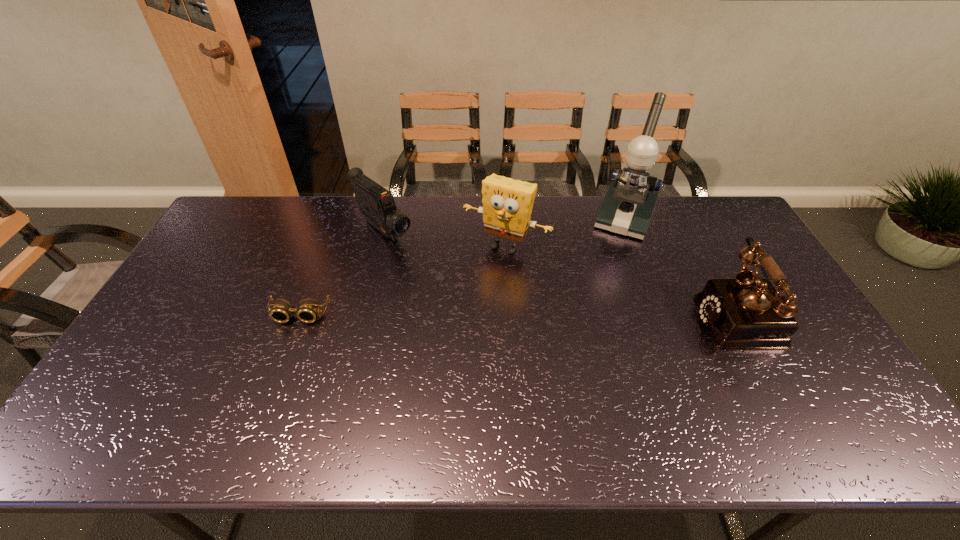
Find the location of a particular element. The height and width of the screenshot is (540, 960). camcorder that is at the far edge is located at coordinates (376, 203).

Where is `object that is positioned at the right edge`? The height and width of the screenshot is (540, 960). object that is positioned at the right edge is located at coordinates (747, 312).

You are a GUI agent. You are given a task and a screenshot of the screen. Output one action in this format:
    pyautogui.click(x=<x>, y=<y>)
    Task: Click on the free spot at the far edge of the desktop
    
    Given the screenshot: What is the action you would take?
    pyautogui.click(x=468, y=218)

Locate an element on the screen. The width and height of the screenshot is (960, 540). vacant space at the near edge is located at coordinates (627, 399).

Where is `free space at the left edge of the desktop`? This screenshot has width=960, height=540. free space at the left edge of the desktop is located at coordinates (210, 268).

Where is `vacant region between the third object from left to right and the telephone`? Image resolution: width=960 pixels, height=540 pixels. vacant region between the third object from left to right and the telephone is located at coordinates (623, 281).

Identify the location of free space between the shortest object and the third object from right to left. (402, 281).

Locate an element on the screen. This screenshot has width=960, height=540. vacant point located between the goggles and the third object from right to left is located at coordinates (402, 281).

Locate an element on the screen. This screenshot has width=960, height=540. vacant area that lies between the camcorder and the shortest object is located at coordinates (342, 273).

Where is `unoccupied area between the telephone and the camcorder`? This screenshot has height=540, width=960. unoccupied area between the telephone and the camcorder is located at coordinates (563, 273).